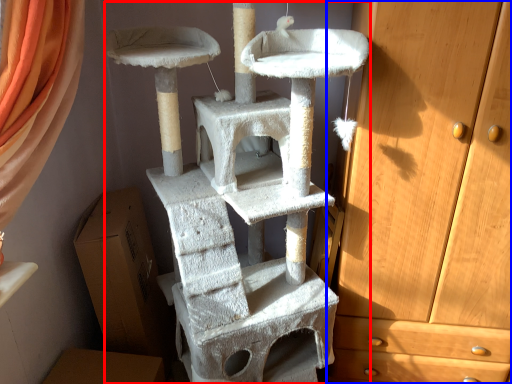
Question: Which point is closer to the camera, bunk bed (highlighted by a red box) or chest of drawers (highlighted by a blue box)?

Choices:
 (A) bunk bed
 (B) chest of drawers

Answer: (A)